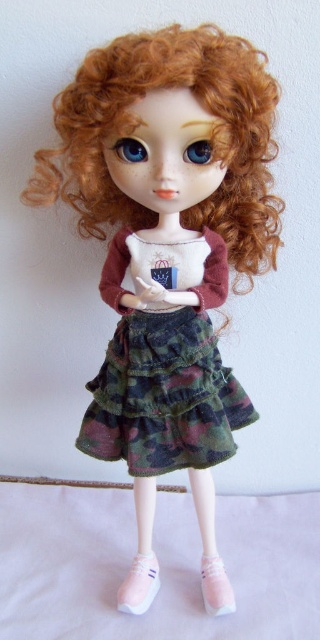
From the picture: You are a photographer setting up a shot of the doll. You want to focus on the camouflage fabric skirt at center. Since the skirt is 1.03 meters away from the camera, what is the minimum focusing distance your camera lens should have to capture it clearly?

The camouflage fabric skirt at center is 1.03 meters away from the camera, so the camera lens must have a minimum focusing distance of at least 1.03 meters to capture it clearly.

You are standing in front of the doll and want to reach a point located at coordinates point (137, 584). Considering your arm length is 2.5 feet, can you reach that point without moving closer?

The point (137, 584) is 3.72 feet away from the viewer. Since your arm length is only 2.5 feet, you cannot reach that point without moving closer.

You are a fashion designer who wants to create a matching accessory for the doll. Given the camouflage fabric skirt at center and the pink suede shoe at lower center, which item should you consider for a larger accessory to maintain proportion?

The camouflage fabric skirt at center is larger than the pink suede shoe at lower center, so you should create a larger accessory that complements the size of the camouflage fabric skirt at center.